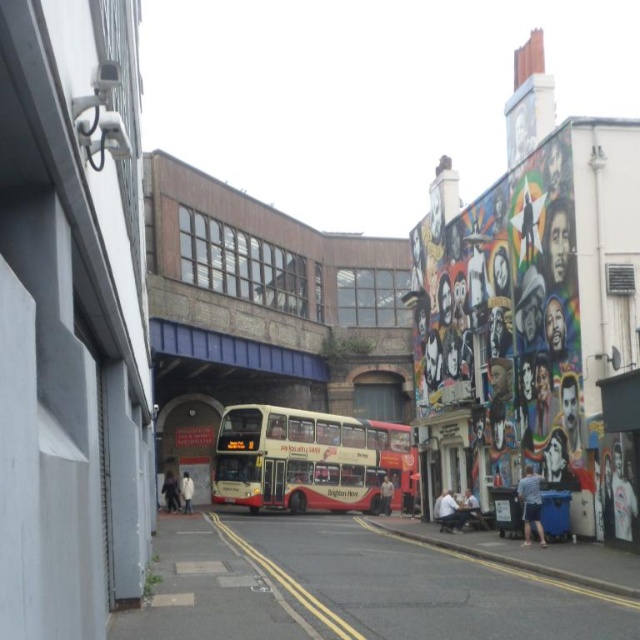
Is white painted wall at right taller than light brown leather jacket at center?

Yes, white painted wall at right is taller than light brown leather jacket at center.

Is white painted wall at right smaller than light brown leather jacket at center?

Indeed, white painted wall at right has a smaller size compared to light brown leather jacket at center.

What do you see at coordinates (621, 458) in the screenshot?
I see `white painted wall at right` at bounding box center [621, 458].

Identify the location of white painted wall at right. (621, 458).

In the scene shown: Is dark gray jacket at lower left further to the viewer compared to light brown leather jacket at center?

No, it is in front of light brown leather jacket at center.

Is point (170, 480) positioned in front of point (385, 483)?

No, (170, 480) is behind (385, 483).

Image resolution: width=640 pixels, height=640 pixels. Describe the element at coordinates (170, 492) in the screenshot. I see `dark gray jacket at lower left` at that location.

Find the location of a particular element. This screenshot has width=640, height=640. dark gray jacket at lower left is located at coordinates (170, 492).

Can you confirm if beige metallic bus at center is bigger than dark gray jacket at lower left?

Yes.

Find the location of a particular element. This screenshot has height=640, width=640. beige metallic bus at center is located at coordinates (294, 460).